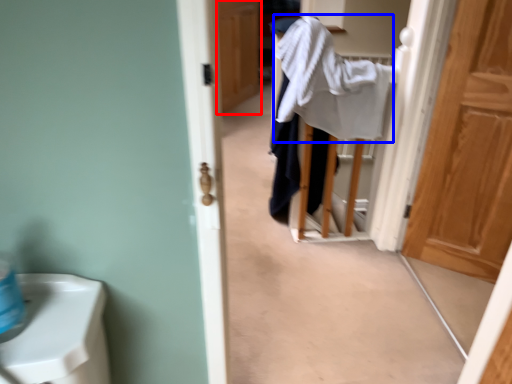
Question: Which point is further to the camera, door (highlighted by a red box) or bath towel (highlighted by a blue box)?

Choices:
 (A) door
 (B) bath towel

Answer: (A)